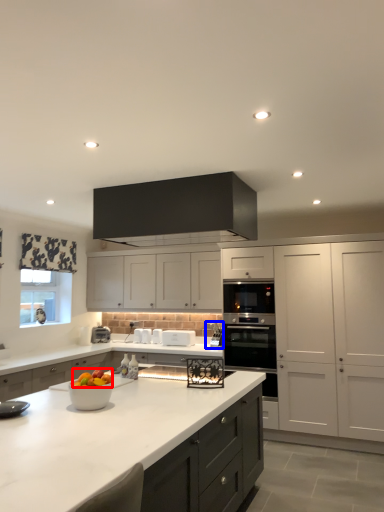
Question: Which object is closer to the camera taking this photo, fruit (highlighted by a red box) or appliance (highlighted by a blue box)?

Choices:
 (A) fruit
 (B) appliance

Answer: (A)